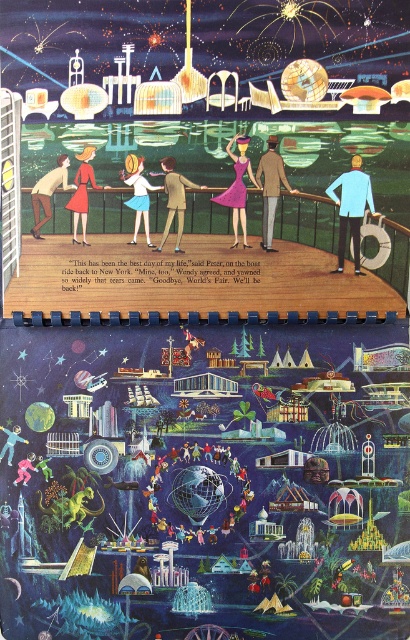
What do you see at coordinates (271, 188) in the screenshot? I see `tan fabric jacket at center` at bounding box center [271, 188].

Does tan fabric jacket at center have a larger size compared to matte brown suit at center?

Correct, tan fabric jacket at center is larger in size than matte brown suit at center.

What are the coordinates of `tan fabric jacket at center` in the screenshot? It's located at (271, 188).

Consider the image. Who is more distant from viewer, (x=168, y=176) or (x=129, y=200)?

Positioned behind is point (x=168, y=176).

Can you confirm if matte brown suit at center is wider than matte white dress at center?

Correct, the width of matte brown suit at center exceeds that of matte white dress at center.

This screenshot has width=410, height=640. In order to click on matte brown suit at center in this screenshot , I will do `click(175, 198)`.

Is matte purple dress at center to the right of matte red dress at left from the viewer's perspective?

Yes, matte purple dress at center is to the right of matte red dress at left.

Between point (236, 161) and point (32, 193), which one is positioned in front?

Point (236, 161)

Where is `matte purple dress at center`? The width and height of the screenshot is (410, 640). matte purple dress at center is located at coordinates (237, 188).